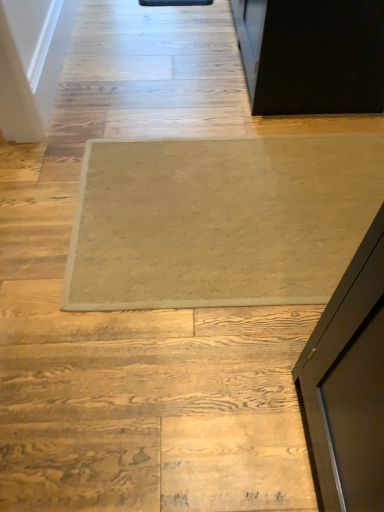
Where is `beige carpet at center`? The image size is (384, 512). beige carpet at center is located at coordinates (134, 379).

Measure the distance between point (57,245) and camera.

Point (57,245) and camera are 4.67 feet apart from each other.

The width and height of the screenshot is (384, 512). Describe the element at coordinates (134, 379) in the screenshot. I see `beige carpet at center` at that location.

At what (x,y) coordinates should I click in order to perform the action: click on beige carpet at center. Please return your answer as a coordinate pair (x, y). This screenshot has height=512, width=384. Looking at the image, I should click on (220, 220).

Describe the element at coordinates (220, 220) in the screenshot. I see `beige carpet at center` at that location.

Identify the location of beige carpet at center. This screenshot has height=512, width=384. (134, 379).

Visually, is beige carpet at center positioned to the left or to the right of beige carpet at center?

beige carpet at center is to the right of beige carpet at center.

Which object is further away from the camera taking this photo, beige carpet at center or beige carpet at center?

beige carpet at center is further from the camera.

Which is closer, (358, 224) or (24, 353)?

Point (358, 224) is farther from the camera than point (24, 353).

From the image's perspective, between beige carpet at center and beige carpet at center, which one is located above?

beige carpet at center is shown above in the image.

From a real-world perspective, relative to beige carpet at center, is beige carpet at center vertically above or below?

From a real-world perspective, beige carpet at center is physically below beige carpet at center.

Does beige carpet at center have a lesser width compared to beige carpet at center?

Indeed, beige carpet at center has a lesser width compared to beige carpet at center.

Is beige carpet at center taller or shorter than beige carpet at center?

In the image, beige carpet at center appears to be shorter than beige carpet at center.

Can you confirm if beige carpet at center is smaller than beige carpet at center?

Yes.

From the picture: Would you say beige carpet at center is inside or outside beige carpet at center?

beige carpet at center fits inside beige carpet at center.

Is beige carpet at center positioned far away from beige carpet at center?

That's not correct — beige carpet at center is a little close to beige carpet at center.

Does beige carpet at center turn towards beige carpet at center?

Yes, beige carpet at center is facing beige carpet at center.

What are the coordinates of `mat below the beige carpet at center (from the image's perspective)` in the screenshot? It's located at (220, 220).

Between beige carpet at center and beige carpet at center, which one appears on the left side from the viewer's perspective?

beige carpet at center.

Is beige carpet at center in front of or behind beige carpet at center in the image?

Clearly, beige carpet at center is in front of beige carpet at center.

Which point is more distant from viewer, (17, 166) or (103, 269)?

Positioned behind is point (17, 166).

From the image's perspective, is beige carpet at center under beige carpet at center?

Actually, beige carpet at center appears above beige carpet at center in the image.

From a real-world perspective, is beige carpet at center beneath beige carpet at center?

Incorrect, from a real-world perspective, beige carpet at center is higher than beige carpet at center.

Considering the relative sizes of beige carpet at center and beige carpet at center in the image provided, is beige carpet at center wider than beige carpet at center?

Yes.

In terms of height, does beige carpet at center look taller or shorter compared to beige carpet at center?

beige carpet at center is taller than beige carpet at center.

Who is smaller, beige carpet at center or beige carpet at center?

With smaller size is beige carpet at center.

Would you say beige carpet at center is inside or outside beige carpet at center?

beige carpet at center cannot be found inside beige carpet at center.

Is beige carpet at center next to beige carpet at center?

No, beige carpet at center is not beside beige carpet at center.

Is beige carpet at center turned away from beige carpet at center?

Yes, beige carpet at center is positioned with its back facing beige carpet at center.

In order to click on mat located on the right of beige carpet at center in this screenshot , I will do point(220,220).

The width and height of the screenshot is (384, 512). I want to click on stairwell on the left side of beige carpet at center, so click(x=134, y=379).

You are a GUI agent. You are given a task and a screenshot of the screen. Output one action in this format:
    pyautogui.click(x=<x>, y=<y>)
    Task: Click on the mat on the right side of beige carpet at center
    
    Given the screenshot: What is the action you would take?
    pyautogui.click(x=220, y=220)